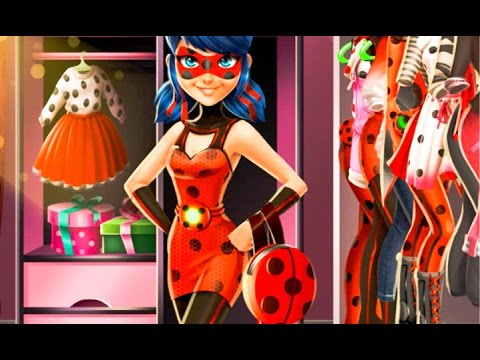
Locate an element on the screen. hanger is located at coordinates (82, 63).